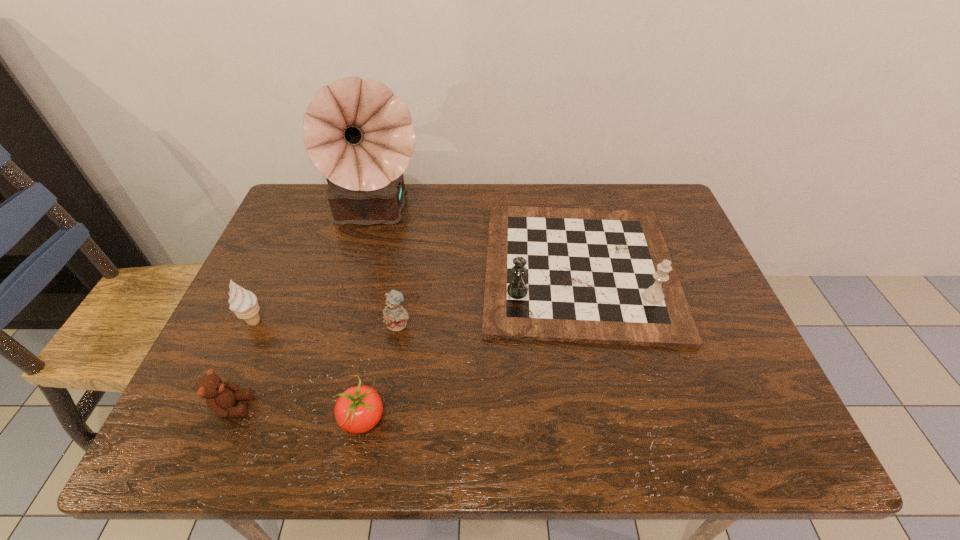
Where is `free space between the left teddy bear and the right teddy bear`? free space between the left teddy bear and the right teddy bear is located at coordinates (316, 366).

The width and height of the screenshot is (960, 540). I want to click on vacant area between the tomato and the tallest object, so click(x=369, y=317).

The image size is (960, 540). Find the location of `unoccupied area between the icecream and the record player`. unoccupied area between the icecream and the record player is located at coordinates (314, 268).

Where is `free space between the icecream and the farther teddy bear`? This screenshot has height=540, width=960. free space between the icecream and the farther teddy bear is located at coordinates (326, 323).

Find the location of a particular element. Image resolution: width=960 pixels, height=540 pixels. free space between the farther teddy bear and the nearer teddy bear is located at coordinates (316, 366).

The width and height of the screenshot is (960, 540). Identify the location of free spot between the rightmost object and the icecream. (417, 295).

Where is `free space that is in between the tomato and the icecream`? free space that is in between the tomato and the icecream is located at coordinates (309, 370).

Locate an element on the screen. The width and height of the screenshot is (960, 540). empty space between the rightmost object and the tallest object is located at coordinates (476, 242).

I want to click on object identified as the closest to the nearer teddy bear, so click(x=243, y=303).

Locate which object is the fourth closest to the left teddy bear. Please provide its 2D coordinates. Your answer should be formatted as a tuple, i.e. [(x, y)], where the tuple contains the x and y coordinates of a point satisfying the conditions above.

[(358, 134)]